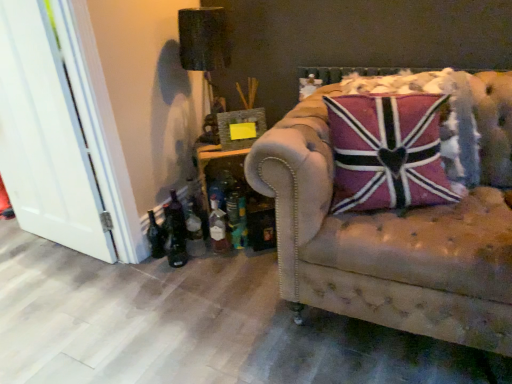
I want to click on vacant area that lies in front of dark glass bottle at lower left, which is the 1th bottle from left to right, so click(153, 276).